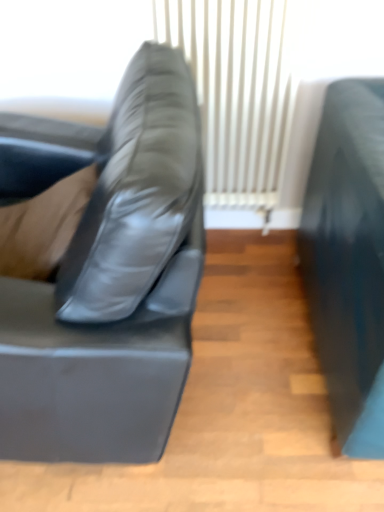
Question: From the image's perspective, is matte black couch at left positioned above or below white matte curtain at center?

Choices:
 (A) below
 (B) above

Answer: (A)

Question: From a real-world perspective, is matte black couch at left above or below white matte curtain at center?

Choices:
 (A) above
 (B) below

Answer: (B)

Question: Is point (152, 432) positioned closer to the camera than point (205, 175)?

Choices:
 (A) farther
 (B) closer

Answer: (B)

Question: From a real-world perspective, relative to matte black couch at left, is white matte curtain at center vertically above or below?

Choices:
 (A) above
 (B) below

Answer: (A)

Question: Looking at their shapes, would you say white matte curtain at center is wider or thinner than matte black couch at left?

Choices:
 (A) thin
 (B) wide

Answer: (A)

Question: Would you say white matte curtain at center is to the left or to the right of matte black couch at left in the picture?

Choices:
 (A) right
 (B) left

Answer: (A)

Question: In terms of height, does white matte curtain at center look taller or shorter compared to matte black couch at left?

Choices:
 (A) tall
 (B) short

Answer: (A)